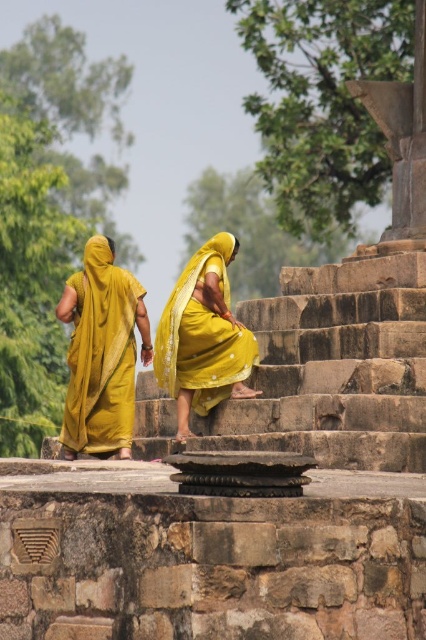
Can you confirm if matte yellow sari at left is bigger than yellow silk saree at center?

Correct, matte yellow sari at left is larger in size than yellow silk saree at center.

Which is in front, point (86, 339) or point (218, 381)?

Point (218, 381) is in front.

Who is more forward, (86,403) or (160,358)?

Positioned in front is point (86,403).

Locate an element on the screen. matte yellow sari at left is located at coordinates (100, 353).